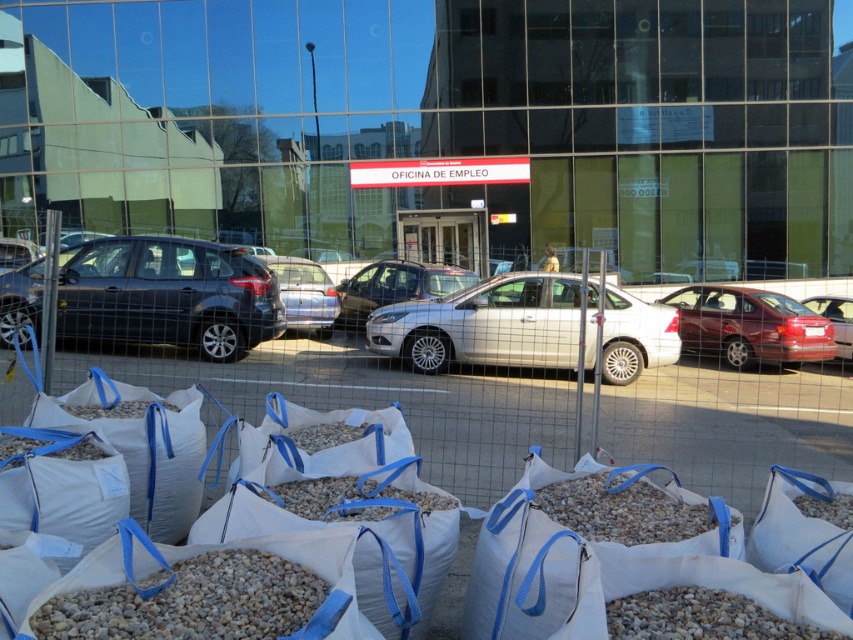
From the picture: You are standing at the entrance of the Employment Office and want to walk to the point marked by point (x=299, y=570). There is an obstacle at point (x=287, y=296). Will you need to go around the obstacle to reach your destination?

Point (x=299, y=570) is in front of point (x=287, y=296), so you will not need to go around the obstacle to reach your destination because the destination is closer to you than the obstacle.

You are a delivery person trying to park your truck in the parking area near the Employment Office. You notice gray gravel at lower center and a matte red car at right. Which object takes up more space in the parking area?

The matte red car at right takes up more space in the parking area because the gray gravel at lower center is smaller than the matte red car at right.